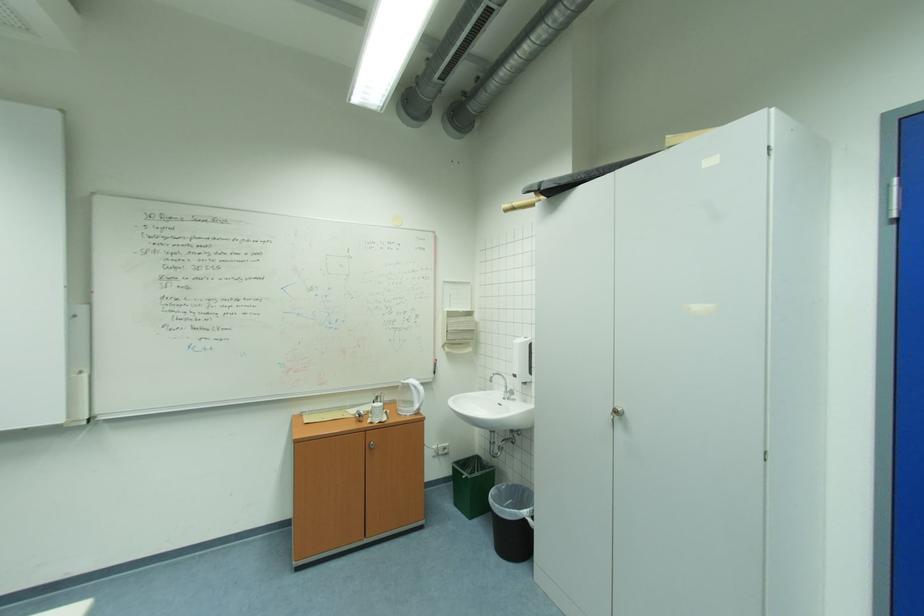
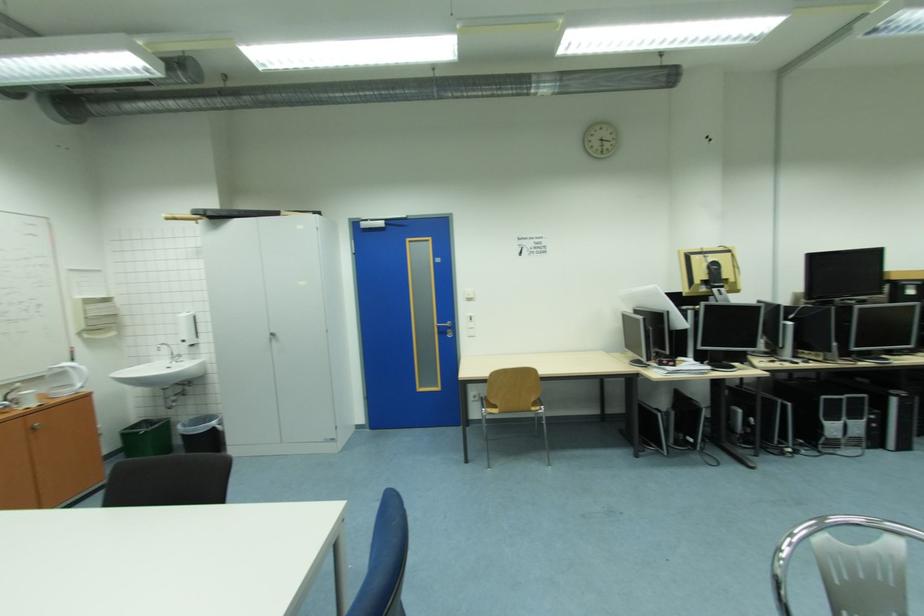
Where in the second image is the point corresponding to pixel 466 464 from the first image?

(130, 431)